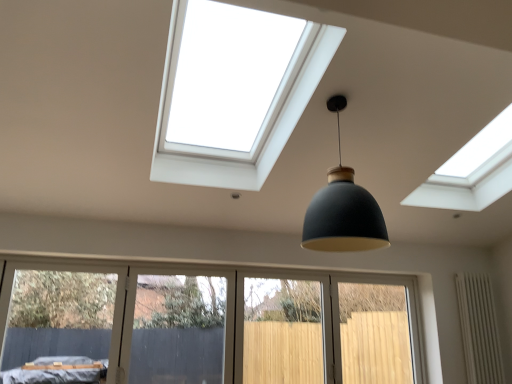
Question: Is there a large distance between light wood screen door at lower center, which is the 1th screen door in right-to-left order, and white textured radiator at lower right?

Choices:
 (A) yes
 (B) no

Answer: (B)

Question: Is light wood screen door at lower center, which appears as the 2th screen door when viewed from the left, located outside white textured radiator at lower right?

Choices:
 (A) no
 (B) yes

Answer: (B)

Question: Can you confirm if light wood screen door at lower center, which appears as the 2th screen door when viewed from the left, is smaller than white textured radiator at lower right?

Choices:
 (A) yes
 (B) no

Answer: (B)

Question: Is light wood screen door at lower center, which appears as the 2th screen door when viewed from the left, to the left of white textured radiator at lower right from the viewer's perspective?

Choices:
 (A) yes
 (B) no

Answer: (A)

Question: From a real-world perspective, is light wood screen door at lower center, which appears as the 2th screen door when viewed from the left, under white textured radiator at lower right?

Choices:
 (A) no
 (B) yes

Answer: (B)

Question: Is light wood screen door at lower center, which appears as the 2th screen door when viewed from the left, with white textured radiator at lower right?

Choices:
 (A) yes
 (B) no

Answer: (B)

Question: Is matte black pendant light at center taller than transparent plastic screen door at lower center, which ranks as the first screen door in left-to-right order?

Choices:
 (A) yes
 (B) no

Answer: (B)

Question: Is matte black pendant light at center surrounding transparent plastic screen door at lower center, which ranks as the first screen door in left-to-right order?

Choices:
 (A) no
 (B) yes

Answer: (A)

Question: Is matte black pendant light at center located outside transparent plastic screen door at lower center, which ranks as the 2th screen door in right-to-left order?

Choices:
 (A) no
 (B) yes

Answer: (B)

Question: Is matte black pendant light at center bigger than transparent plastic screen door at lower center, which ranks as the 2th screen door in right-to-left order?

Choices:
 (A) yes
 (B) no

Answer: (A)

Question: Considering the relative sizes of matte black pendant light at center and transparent plastic screen door at lower center, which ranks as the 2th screen door in right-to-left order, in the image provided, is matte black pendant light at center shorter than transparent plastic screen door at lower center, which ranks as the 2th screen door in right-to-left order,?

Choices:
 (A) yes
 (B) no

Answer: (A)

Question: From the image's perspective, does matte black pendant light at center appear lower than transparent plastic screen door at lower center, which ranks as the first screen door in left-to-right order?

Choices:
 (A) no
 (B) yes

Answer: (A)

Question: From a real-world perspective, is white textured radiator at lower right positioned over matte black pendant light at center based on gravity?

Choices:
 (A) no
 (B) yes

Answer: (A)